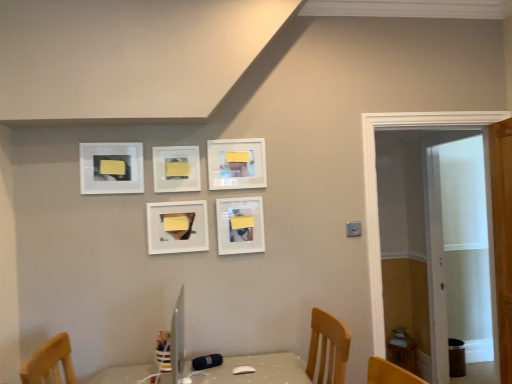
Question: Which direction should I rotate to look at matte white picture frame at center, arranged as the 3th picture frame when viewed from the left?

Choices:
 (A) right
 (B) left

Answer: (B)

Question: Can you confirm if yellow matte picture frame at center, the fourth picture frame in the right-to-left sequence, is smaller than white wooden door at right?

Choices:
 (A) yes
 (B) no

Answer: (A)

Question: From a real-world perspective, is yellow matte picture frame at center, the 2th picture frame positioned from the left, on top of white wooden door at right?

Choices:
 (A) yes
 (B) no

Answer: (A)

Question: Is yellow matte picture frame at center, the fourth picture frame in the right-to-left sequence, oriented towards white wooden door at right?

Choices:
 (A) yes
 (B) no

Answer: (B)

Question: Does yellow matte picture frame at center, the fourth picture frame in the right-to-left sequence, lie in front of white wooden door at right?

Choices:
 (A) yes
 (B) no

Answer: (A)

Question: Considering the relative sizes of yellow matte picture frame at center, the fourth picture frame in the right-to-left sequence, and white wooden door at right in the image provided, is yellow matte picture frame at center, the fourth picture frame in the right-to-left sequence, wider than white wooden door at right?

Choices:
 (A) yes
 (B) no

Answer: (B)

Question: Is yellow matte picture frame at center, the fourth picture frame in the right-to-left sequence, outside white wooden door at right?

Choices:
 (A) no
 (B) yes

Answer: (B)

Question: From a real-world perspective, is matte white picture frame at upper center, acting as the 4th picture frame starting from the left, over yellow matte picture frame at center, the fourth picture frame in the right-to-left sequence?

Choices:
 (A) yes
 (B) no

Answer: (A)

Question: Can you confirm if matte white picture frame at upper center, which is counted as the second picture frame, starting from the right, is positioned to the right of yellow matte picture frame at center, the fourth picture frame in the right-to-left sequence?

Choices:
 (A) no
 (B) yes

Answer: (B)

Question: Is yellow matte picture frame at center, the fourth picture frame in the right-to-left sequence, at the back of matte white picture frame at upper center, acting as the 4th picture frame starting from the left?

Choices:
 (A) no
 (B) yes

Answer: (A)

Question: Does matte white picture frame at upper center, acting as the 4th picture frame starting from the left, have a larger size compared to yellow matte picture frame at center, the fourth picture frame in the right-to-left sequence?

Choices:
 (A) yes
 (B) no

Answer: (A)

Question: Is matte white picture frame at upper center, which is counted as the second picture frame, starting from the right, wider than yellow matte picture frame at center, the 2th picture frame positioned from the left?

Choices:
 (A) no
 (B) yes

Answer: (B)

Question: Is matte white picture frame at upper center, acting as the 4th picture frame starting from the left, smaller than yellow matte picture frame at center, the fourth picture frame in the right-to-left sequence?

Choices:
 (A) no
 (B) yes

Answer: (A)

Question: Considering the relative sizes of matte white picture frame at center, placed as the 5th picture frame when sorted from left to right, and white wooden door at right in the image provided, is matte white picture frame at center, placed as the 5th picture frame when sorted from left to right, taller than white wooden door at right?

Choices:
 (A) no
 (B) yes

Answer: (A)